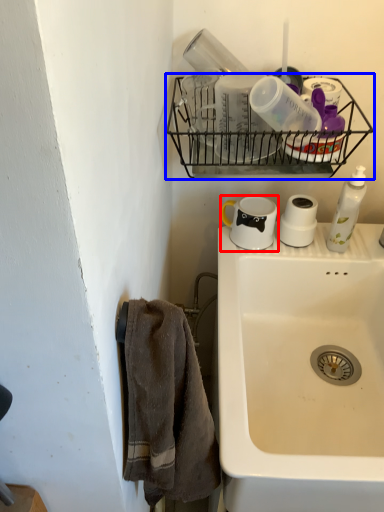
Question: Which of the following is the closest to the observer, coffee cup (highlighted by a red box) or shelf (highlighted by a blue box)?

Choices:
 (A) coffee cup
 (B) shelf

Answer: (B)